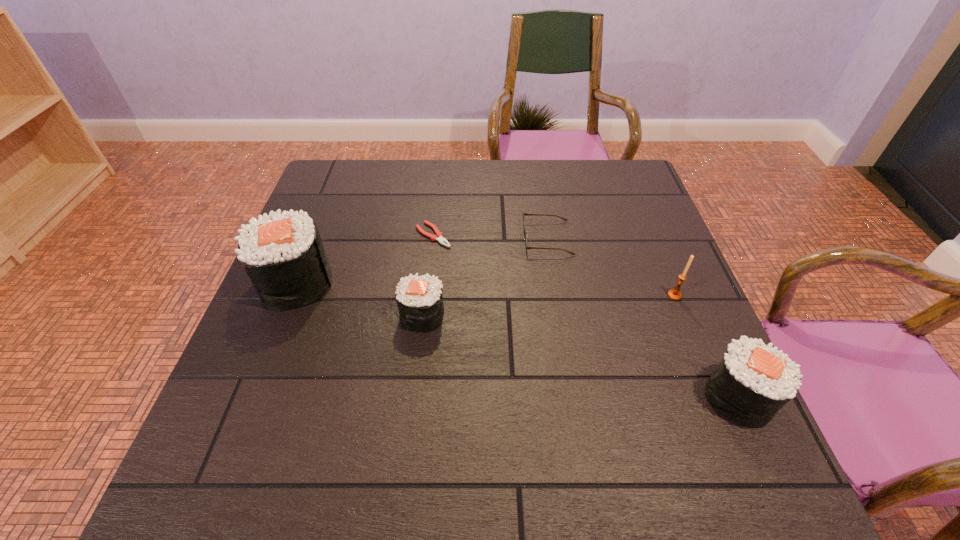
You are a GUI agent. You are given a task and a screenshot of the screen. Output one action in this format:
    pyautogui.click(x=<x>, y=<y>)
    Task: Click on the unoccupied area between the tallest object and the candle_holder
    The width and height of the screenshot is (960, 540).
    Given the screenshot: What is the action you would take?
    pyautogui.click(x=486, y=289)

The height and width of the screenshot is (540, 960). What are the coordinates of `free space between the second tallest sushi and the candle_holder` in the screenshot? It's located at (707, 346).

The height and width of the screenshot is (540, 960). Find the location of `vacant space in between the candle_holder and the nearest sushi`. vacant space in between the candle_holder and the nearest sushi is located at coordinates (707, 346).

At what (x,y) coordinates should I click in order to perform the action: click on unoccupied area between the shortest sushi and the fifth tallest object. Please return your answer as a coordinate pair (x, y). This screenshot has height=540, width=960. Looking at the image, I should click on (485, 276).

Find the location of a particular element. The image size is (960, 540). free space between the fourth object from left to right and the pliers is located at coordinates (491, 237).

At what (x,y) coordinates should I click in order to perform the action: click on free space between the tallest object and the pliers. Please return your answer as a coordinate pair (x, y). Image resolution: width=960 pixels, height=540 pixels. Looking at the image, I should click on (365, 259).

At what (x,y) coordinates should I click in order to perform the action: click on blank region between the rightmost sushi and the shortest object. Please return your answer as a coordinate pair (x, y). This screenshot has width=960, height=540. Looking at the image, I should click on (586, 316).

Identify the location of vacant area that lies between the candle_holder and the fifth tallest object. The image size is (960, 540). (611, 267).

You are a GUI agent. You are given a task and a screenshot of the screen. Output one action in this format:
    pyautogui.click(x=<x>, y=<y>)
    Task: Click on the object that stands as the closest to the tallest sushi
    
    Given the screenshot: What is the action you would take?
    pyautogui.click(x=419, y=298)

Select which object is the fourth closest to the fourth object from left to right. Please provide its 2D coordinates. Your answer should be formatted as a tuple, i.e. [(x, y)], where the tuple contains the x and y coordinates of a point satisfying the conditions above.

[(753, 381)]